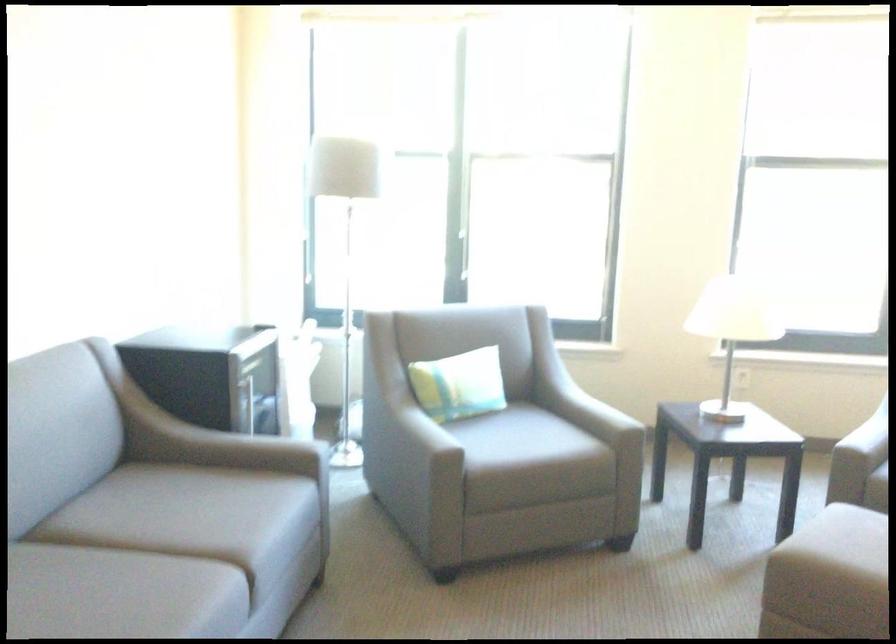
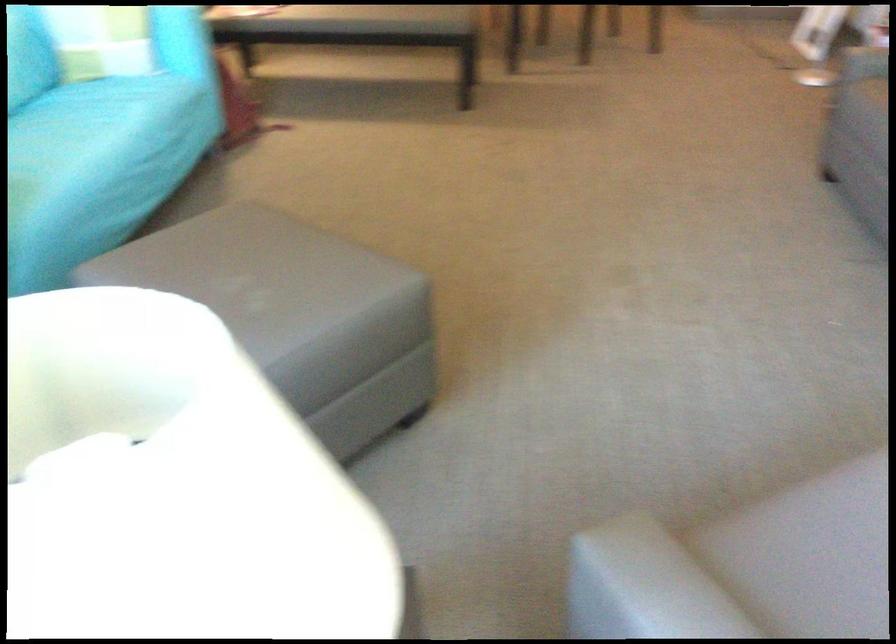
Where in the second image is the point corresponding to point (590, 415) from the first image?

(665, 583)